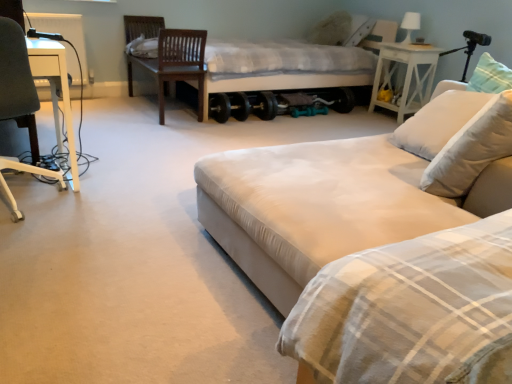
Question: From the image's perspective, is white wood side table at right beneath dark brown wood swivel chair at upper left?

Choices:
 (A) yes
 (B) no

Answer: (A)

Question: Can you confirm if white wood side table at right is wider than dark brown wood swivel chair at upper left?

Choices:
 (A) yes
 (B) no

Answer: (B)

Question: Does white wood side table at right have a smaller size compared to dark brown wood swivel chair at upper left?

Choices:
 (A) yes
 (B) no

Answer: (A)

Question: Is white wood side table at right thinner than dark brown wood swivel chair at upper left?

Choices:
 (A) yes
 (B) no

Answer: (A)

Question: From a real-world perspective, is white wood side table at right below dark brown wood swivel chair at upper left?

Choices:
 (A) no
 (B) yes

Answer: (B)

Question: Would you say white wood side table at right contains dark brown wood swivel chair at upper left?

Choices:
 (A) yes
 (B) no

Answer: (B)

Question: Does white glossy table lamp at upper right lie in front of dark brown wood swivel chair at upper left?

Choices:
 (A) yes
 (B) no

Answer: (B)

Question: Does white glossy table lamp at upper right have a lesser width compared to dark brown wood swivel chair at upper left?

Choices:
 (A) yes
 (B) no

Answer: (A)

Question: Is white glossy table lamp at upper right aimed at dark brown wood swivel chair at upper left?

Choices:
 (A) no
 (B) yes

Answer: (B)

Question: From a real-world perspective, is white glossy table lamp at upper right below dark brown wood swivel chair at upper left?

Choices:
 (A) yes
 (B) no

Answer: (B)

Question: Is white glossy table lamp at upper right to the left of dark brown wood swivel chair at upper left from the viewer's perspective?

Choices:
 (A) yes
 (B) no

Answer: (B)

Question: Can you confirm if white glossy table lamp at upper right is smaller than dark brown wood swivel chair at upper left?

Choices:
 (A) no
 (B) yes

Answer: (B)

Question: Is white wood side table at right completely or partially inside white plastic chair at left?

Choices:
 (A) yes
 (B) no

Answer: (B)